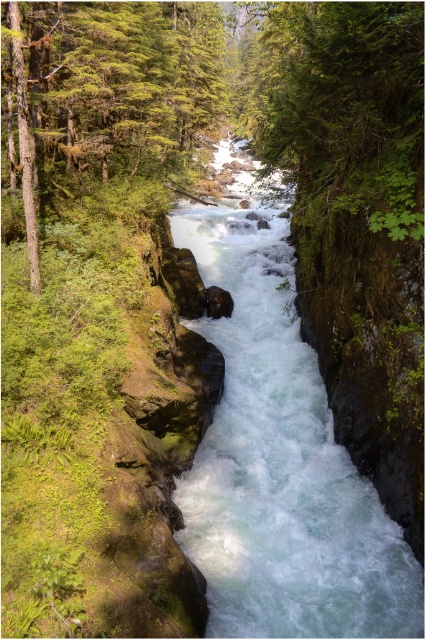
Who is taller, clear water at center or green mossy tree at upper left?

green mossy tree at upper left

At what (x,y) coordinates should I click in order to perform the action: click on clear water at center. Please return your answer as a coordinate pair (x, y). The width and height of the screenshot is (426, 640). Looking at the image, I should click on (279, 458).

The width and height of the screenshot is (426, 640). Find the location of `clear water at center`. clear water at center is located at coordinates (279, 458).

You are a GUI agent. You are given a task and a screenshot of the screen. Output one action in this format:
    pyautogui.click(x=<x>, y=<y>)
    Task: Click on the clear water at center
    This screenshot has height=640, width=426.
    Given the screenshot: What is the action you would take?
    pyautogui.click(x=279, y=458)